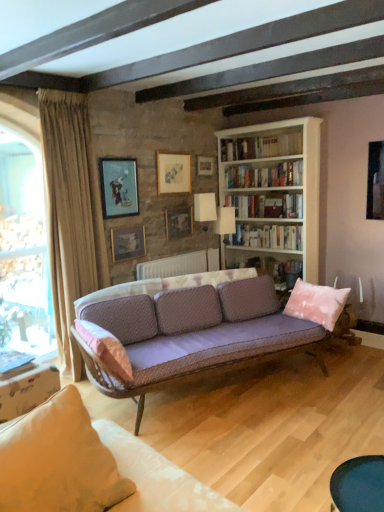
Locate an element on the screen. The width and height of the screenshot is (384, 512). free spot above smooth dark blue table at lower right, which appears as the second table when viewed from the left (from a real-world perspective) is located at coordinates (361, 480).